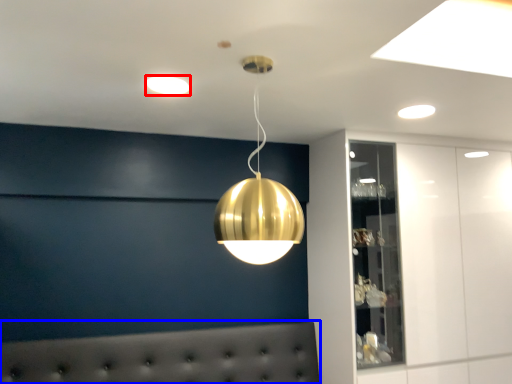
Question: Among these objects, which one is nearest to the camera, lamp (highlighted by a red box) or furniture (highlighted by a blue box)?

Choices:
 (A) lamp
 (B) furniture

Answer: (A)